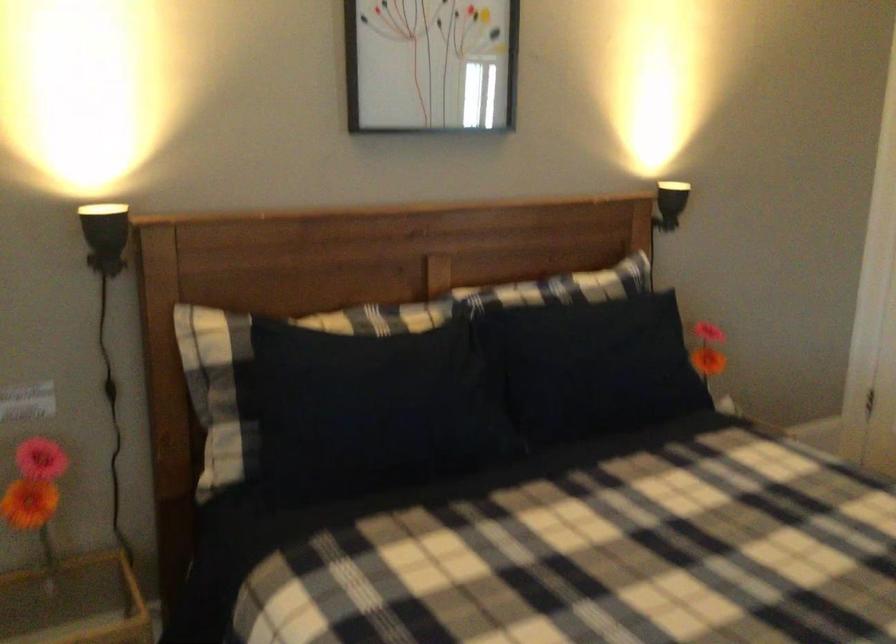
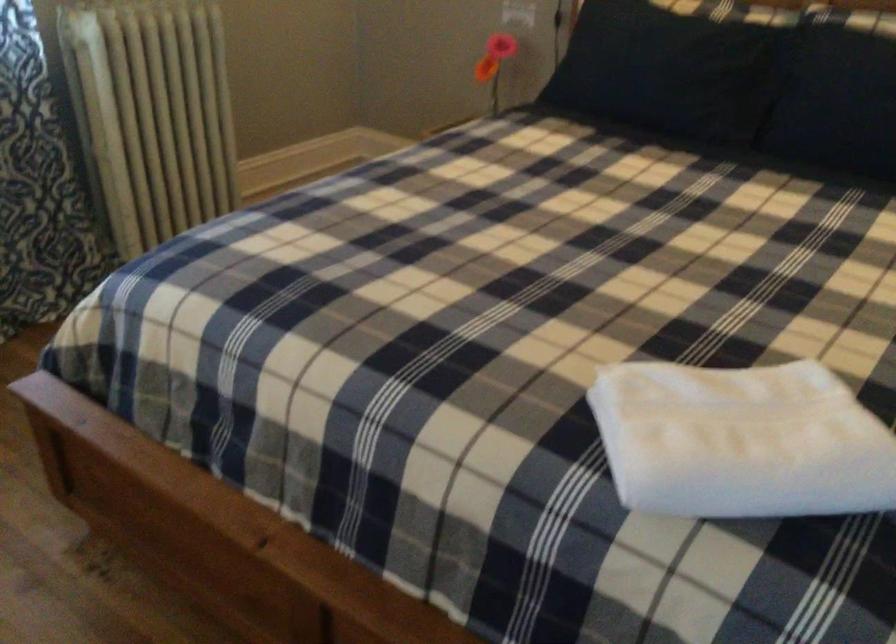
In the second image, find the point that corresponds to point 446,402 in the first image.

(664, 71)